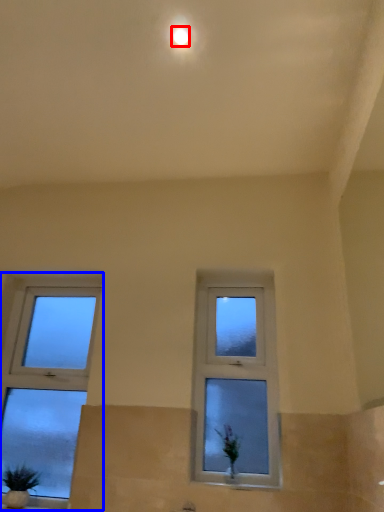
Question: Which object appears farthest to the camera in this image, lighting (highlighted by a red box) or window (highlighted by a blue box)?

Choices:
 (A) lighting
 (B) window

Answer: (B)